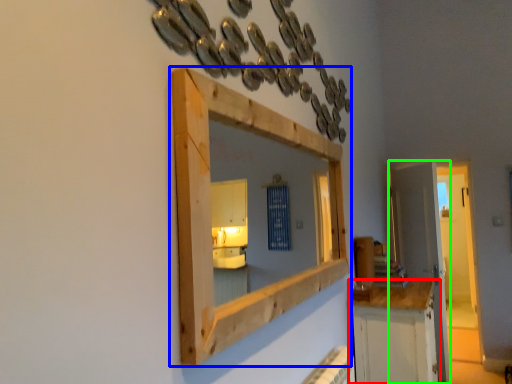
Question: Which object is the closest to the cabinetry (highlighted by a red box)? Choose among these: medicine cabinet (highlighted by a blue box) or door (highlighted by a green box).

Choices:
 (A) medicine cabinet
 (B) door

Answer: (A)